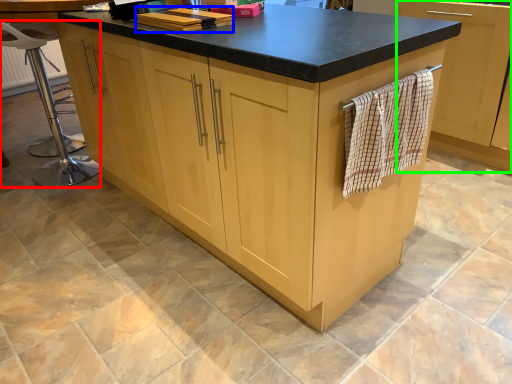
Question: Estimate the real-world distances between objects in this image. Which object is farther from bar stool (highlighted by a red box), book (highlighted by a blue box) or cabinetry (highlighted by a green box)?

Choices:
 (A) book
 (B) cabinetry

Answer: (B)